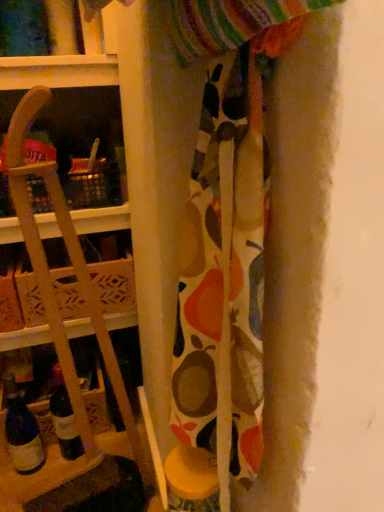
Question: Is wooden at left facing towards patterned fabric at center?

Choices:
 (A) no
 (B) yes

Answer: (A)

Question: Would you consider wooden at left to be distant from patterned fabric at center?

Choices:
 (A) no
 (B) yes

Answer: (A)

Question: Is the depth of wooden at left greater than that of patterned fabric at center?

Choices:
 (A) no
 (B) yes

Answer: (B)

Question: Can you confirm if wooden at left is shorter than patterned fabric at center?

Choices:
 (A) no
 (B) yes

Answer: (A)

Question: Is wooden at left taller than patterned fabric at center?

Choices:
 (A) no
 (B) yes

Answer: (B)

Question: In terms of size, does translucent glass wine bottle at lower left appear bigger or smaller than patterned fabric at center?

Choices:
 (A) big
 (B) small

Answer: (B)

Question: Visually, is translucent glass wine bottle at lower left positioned to the left or to the right of patterned fabric at center?

Choices:
 (A) left
 (B) right

Answer: (A)

Question: Considering the positions of point (8, 432) and point (210, 115), is point (8, 432) closer or farther from the camera than point (210, 115)?

Choices:
 (A) closer
 (B) farther

Answer: (B)

Question: Is translucent glass wine bottle at lower left situated inside patterned fabric at center or outside?

Choices:
 (A) outside
 (B) inside

Answer: (A)

Question: From the image's perspective, is wooden at left above or below translucent glass wine bottle at lower left?

Choices:
 (A) above
 (B) below

Answer: (A)

Question: Looking at the image, does wooden at left seem bigger or smaller compared to translucent glass wine bottle at lower left?

Choices:
 (A) small
 (B) big

Answer: (B)

Question: Considering the relative positions of wooden at left and translucent glass wine bottle at lower left in the image provided, is wooden at left to the left or to the right of translucent glass wine bottle at lower left?

Choices:
 (A) left
 (B) right

Answer: (B)

Question: In terms of width, does wooden at left look wider or thinner when compared to translucent glass wine bottle at lower left?

Choices:
 (A) thin
 (B) wide

Answer: (B)

Question: Considering the positions of wooden at left and patterned fabric at center in the image, is wooden at left wider or thinner than patterned fabric at center?

Choices:
 (A) thin
 (B) wide

Answer: (B)

Question: Considering their positions, is wooden at left located in front of or behind patterned fabric at center?

Choices:
 (A) front
 (B) behind

Answer: (B)